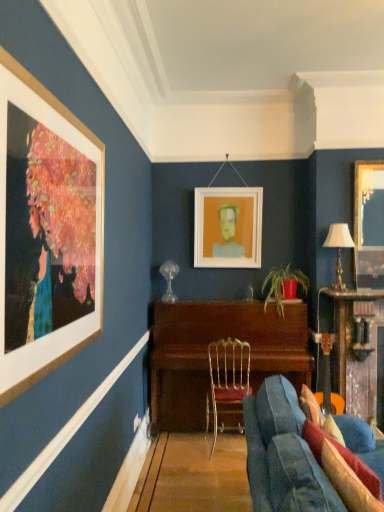
The height and width of the screenshot is (512, 384). What are the coordinates of `free point below white matte picture frame at center, which is the second picture frame in front-to-back order (from a real-world perspective)` in the screenshot? It's located at (220, 297).